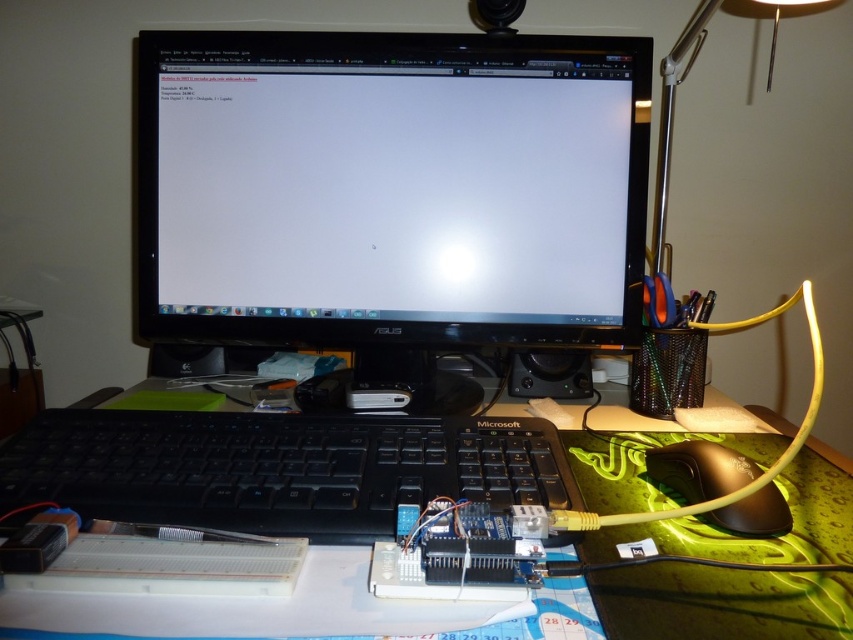
Question: Can you confirm if green rubber mousepad at center is positioned to the left of metallic silver lamp at upper right?

Choices:
 (A) no
 (B) yes

Answer: (B)

Question: Can you confirm if black plastic keyboard at center is positioned below black plastic mouse at lower right?

Choices:
 (A) no
 (B) yes

Answer: (A)

Question: Estimate the real-world distances between objects in this image. Which object is farther from the black glossy monitor at center?

Choices:
 (A) metallic silver lamp at upper right
 (B) green rubber mousepad at center

Answer: (A)

Question: Considering the relative positions of black glossy monitor at center and black plastic keyboard at center in the image provided, where is black glossy monitor at center located with respect to black plastic keyboard at center?

Choices:
 (A) below
 (B) above

Answer: (B)

Question: Which of the following is the farthest from the observer?

Choices:
 (A) black plastic keyboard at center
 (B) black plastic mouse at lower right
 (C) black glossy monitor at center
 (D) metallic silver lamp at upper right

Answer: (D)

Question: Which point appears closest to the camera in this image?

Choices:
 (A) (666, 468)
 (B) (824, 611)

Answer: (B)